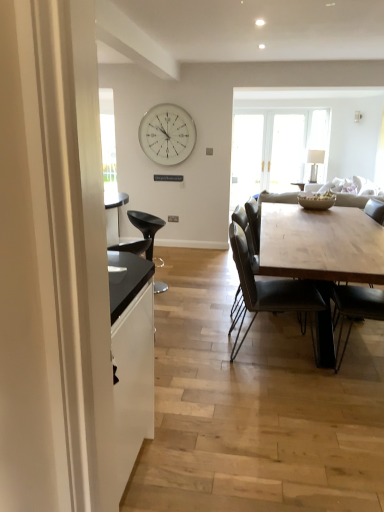
Question: In terms of width, does leather couch at center look wider or thinner when compared to clear glass table lamp at upper right?

Choices:
 (A) wide
 (B) thin

Answer: (A)

Question: Relative to clear glass table lamp at upper right, is leather couch at center in front or behind?

Choices:
 (A) behind
 (B) front

Answer: (B)

Question: Considering the real-world distances, which object is farthest from the black leather chair at center, marked as the third chair in a left-to-right arrangement?

Choices:
 (A) leather couch at center
 (B) black matte bar stool at left, the 1th chair viewed from the left
 (C) clear glass table lamp at upper right
 (D) dark gray leather chair at center, marked as the second chair in a back-to-front arrangement
 (E) white glass clock at upper center

Answer: (E)

Question: Based on their relative distances, which object is nearer to the natural wood table at center?

Choices:
 (A) black leather chair at center, marked as the 1th chair in a right-to-left arrangement
 (B) leather couch at center
 (C) clear glass table lamp at upper right
 (D) dark gray leather chair at center, the second chair in the front-to-back sequence
 (E) black matte bar stool at left, which appears as the first chair when viewed from the back

Answer: (D)